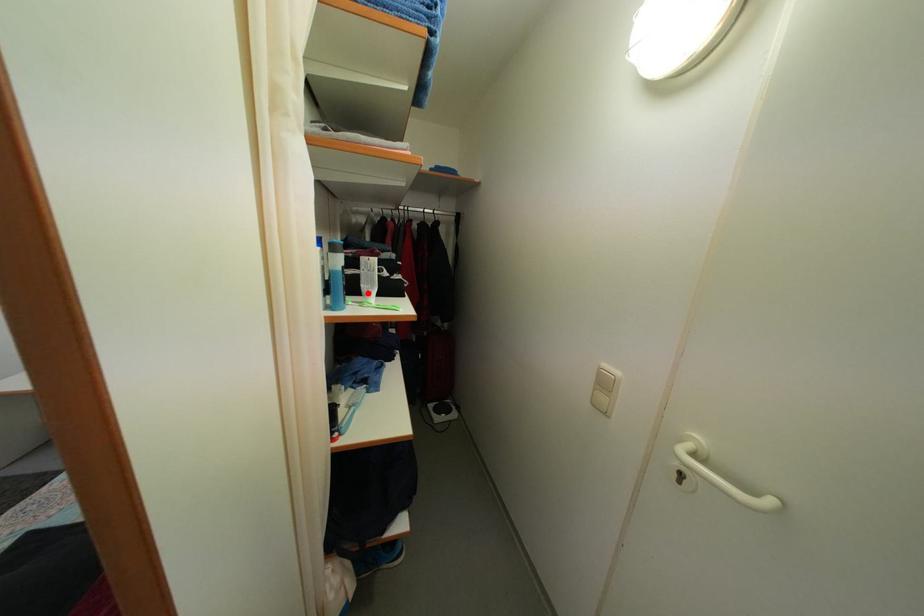
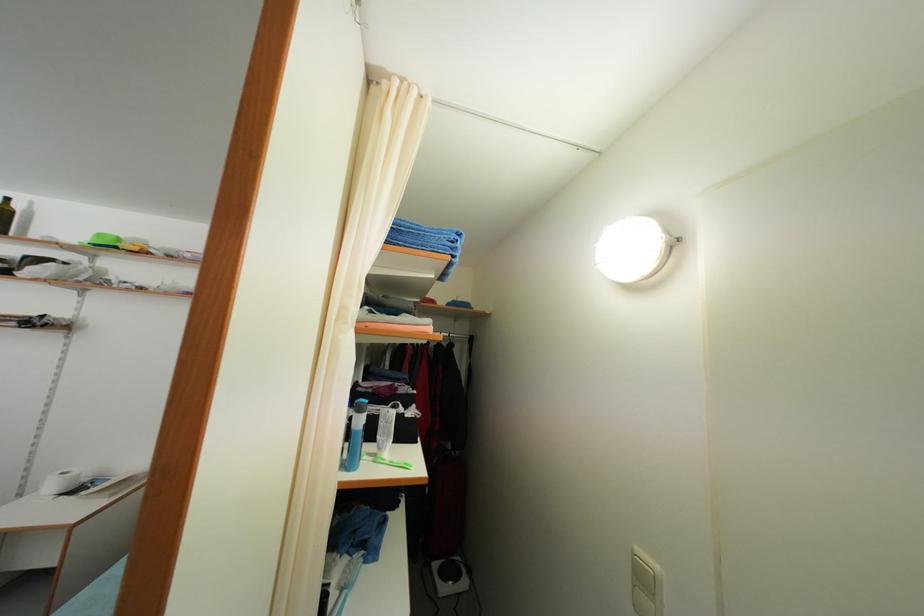
Locate, in the second image, the point that corresponds to the highlighted location in the first image.

(383, 445)